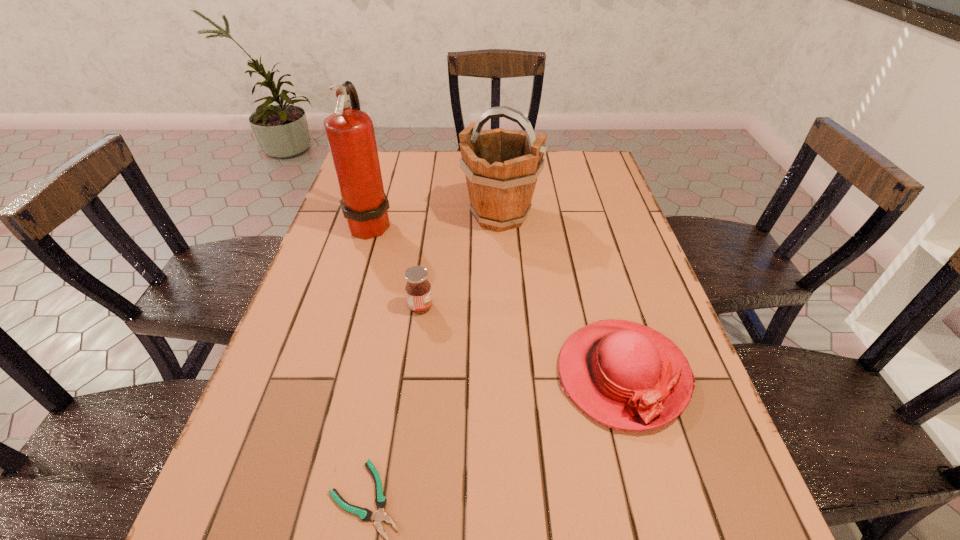
The image size is (960, 540). What are the coordinates of `object present at the right edge` in the screenshot? It's located at (627, 376).

Image resolution: width=960 pixels, height=540 pixels. Identify the location of free space at the far edge. (422, 161).

The image size is (960, 540). I want to click on free region at the near edge, so click(x=433, y=538).

You are a GUI agent. You are given a task and a screenshot of the screen. Output one action in this format:
    pyautogui.click(x=<x>, y=<y>)
    Task: Click on the vacant region at the left edge
    The height and width of the screenshot is (540, 960).
    Given the screenshot: What is the action you would take?
    pyautogui.click(x=333, y=326)

Where is `free region at the right edge of the desktop`? free region at the right edge of the desktop is located at coordinates (661, 429).

In the image, there is a desktop. At what (x,y) coordinates should I click in order to perform the action: click on vacant region at the far right corner. Please return your answer as a coordinate pair (x, y). Looking at the image, I should click on (598, 171).

What are the coordinates of `empty location between the bucket and the leftmost object` in the screenshot? It's located at (436, 219).

This screenshot has width=960, height=540. I want to click on vacant space in between the hat and the bucket, so click(561, 295).

You are a GUI agent. You are given a task and a screenshot of the screen. Output one action in this format:
    pyautogui.click(x=<x>, y=<y>)
    Task: Click on the free space between the second nearest object and the bucket
    The width and height of the screenshot is (960, 540).
    Given the screenshot: What is the action you would take?
    pyautogui.click(x=561, y=295)

The image size is (960, 540). I want to click on free space that is in between the jam and the hat, so pos(521,341).